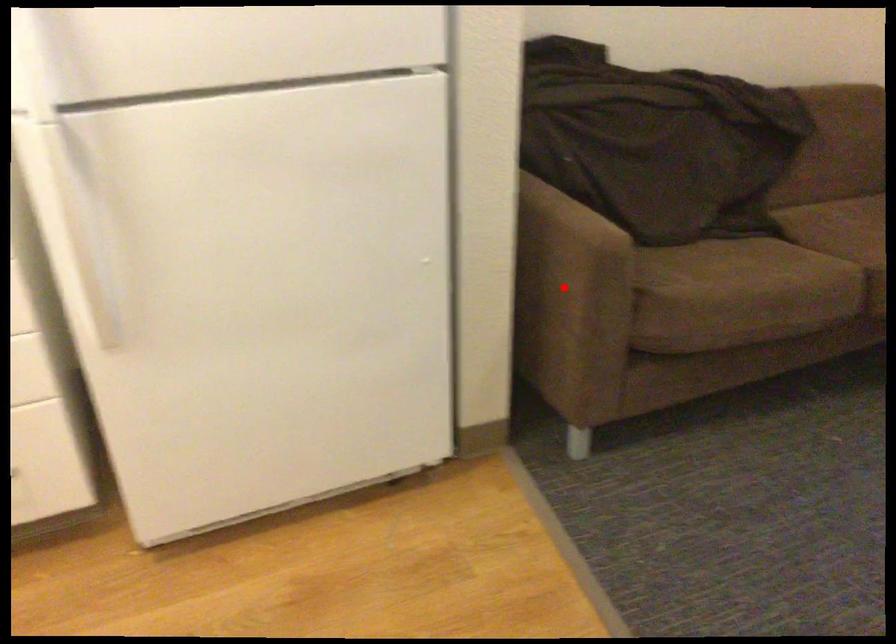
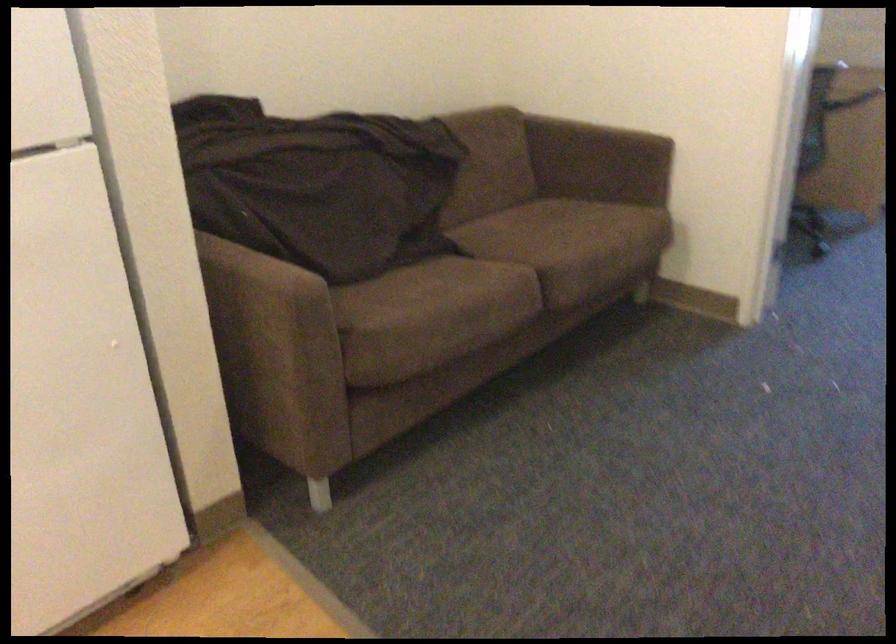
Find the pixel in the second image that matches the highlighted location in the first image.

(271, 342)